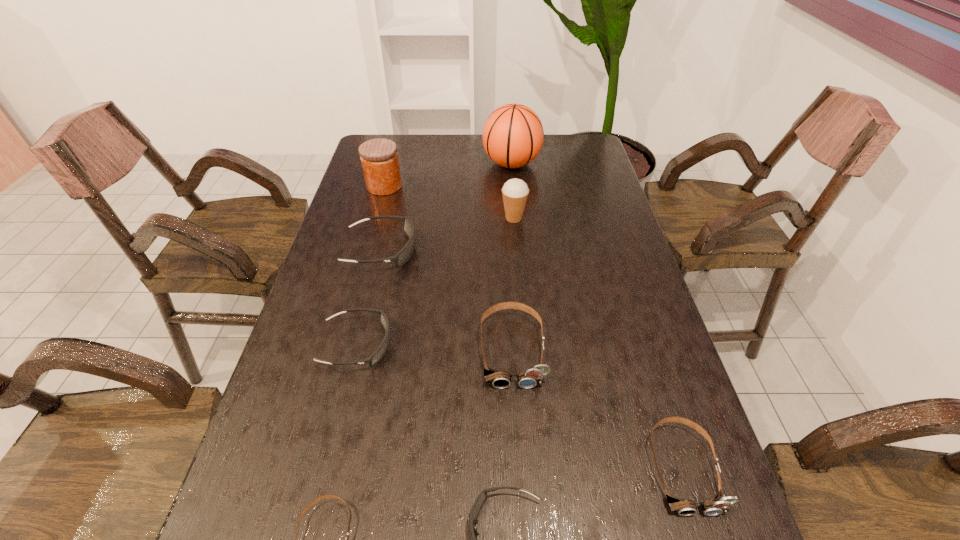
This screenshot has width=960, height=540. Find the location of `the tallest object`. the tallest object is located at coordinates (513, 135).

Where is `basketball`? The width and height of the screenshot is (960, 540). basketball is located at coordinates (513, 135).

Identify the location of orange jar. The width and height of the screenshot is (960, 540). (379, 158).

The width and height of the screenshot is (960, 540). In order to click on the third farthest object in this screenshot , I will do point(515,191).

You are a GUI agent. You are given a task and a screenshot of the screen. Output one action in this format:
    pyautogui.click(x=<x>, y=<y>)
    Task: Click on the farthest goggles
    This screenshot has height=540, width=960.
    Given the screenshot: What is the action you would take?
    pyautogui.click(x=403, y=256)

You are a GUI agent. You are given a task and a screenshot of the screen. Output one action in this format:
    pyautogui.click(x=<x>, y=<y>)
    Task: Click on the farthest black goggles
    This screenshot has height=540, width=960.
    Given the screenshot: What is the action you would take?
    pyautogui.click(x=403, y=256)

In order to click on the biggest brown goggles in this screenshot , I will do `click(499, 379)`.

The width and height of the screenshot is (960, 540). What are the coordinates of `the second brown goggles from right to left` in the screenshot? It's located at (499, 379).

You are a GUI agent. You are given a task and a screenshot of the screen. Output one action in this format:
    pyautogui.click(x=<x>, y=<y>)
    Task: Click on the second nearest black goggles
    The width and height of the screenshot is (960, 540).
    Given the screenshot: What is the action you would take?
    pyautogui.click(x=383, y=319)

Image resolution: width=960 pixels, height=540 pixels. Identify the location of the rightmost object. (719, 504).